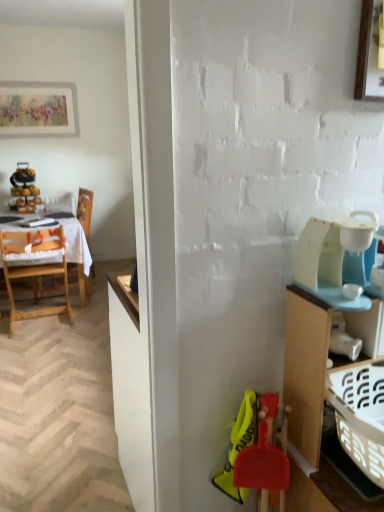
Find the location of a particular element. Image resolution: width=384 pixels, height=512 pixels. vacant space in front of wooden chair at left, the first chair positioned from the front is located at coordinates (34, 339).